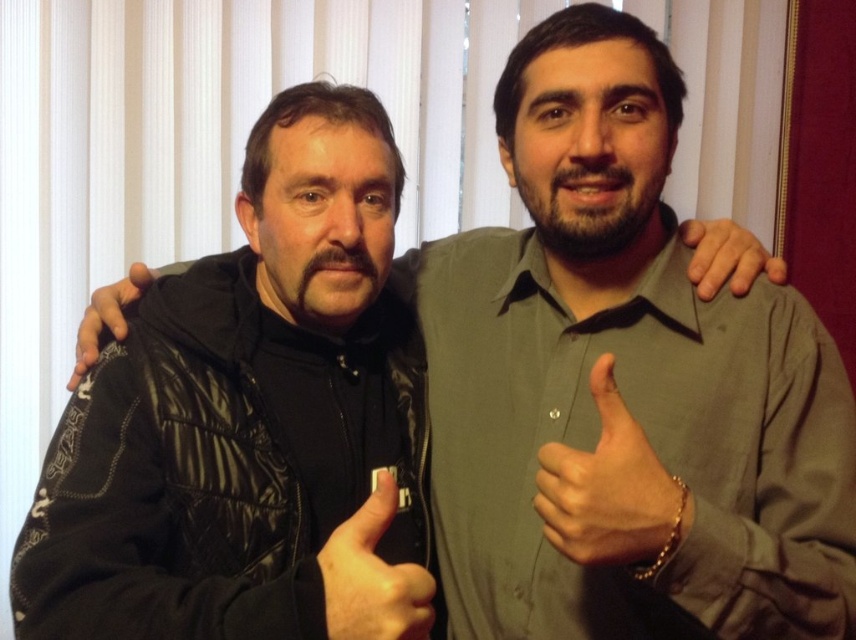
Question: Which of these objects is positioned closest to the black quilted jacket at left?

Choices:
 (A) smooth skin hand at center
 (B) matte gray shirt at center
 (C) leather jacket at left

Answer: (C)

Question: Can you confirm if matte gray shirt at center is positioned to the left of matte black thumb at center?

Choices:
 (A) yes
 (B) no

Answer: (B)

Question: Is the position of black quilted jacket at left more distant than that of smooth skin hand at center?

Choices:
 (A) no
 (B) yes

Answer: (A)

Question: Among these objects, which one is nearest to the camera?

Choices:
 (A) leather jacket at left
 (B) matte gray shirt at center
 (C) matte black thumb at center
 (D) black quilted jacket at left

Answer: (C)

Question: Is black quilted jacket at left to the left of leather jacket at left from the viewer's perspective?

Choices:
 (A) no
 (B) yes

Answer: (A)

Question: Estimate the real-world distances between objects in this image. Which object is farther from the black quilted jacket at left?

Choices:
 (A) matte black thumb at center
 (B) matte gray shirt at center
 (C) leather jacket at left
 (D) smooth skin hand at center

Answer: (D)